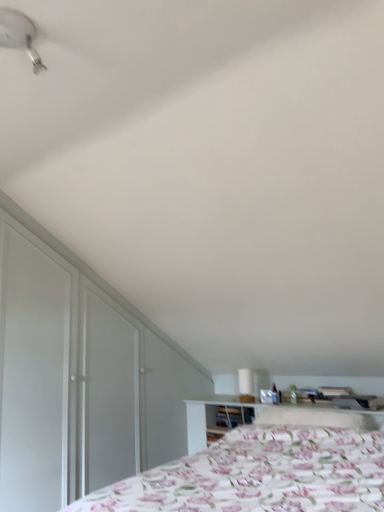
Question: From a real-world perspective, relative to white glossy table lamp at upper center, is white plastic fan at upper left vertically above or below?

Choices:
 (A) above
 (B) below

Answer: (A)

Question: Considering the positions of white plastic fan at upper left and white glossy table lamp at upper center in the image, is white plastic fan at upper left taller or shorter than white glossy table lamp at upper center?

Choices:
 (A) short
 (B) tall

Answer: (A)

Question: Based on their relative distances, which object is nearer to the white plastic fan at upper left?

Choices:
 (A) white glossy dresser at left
 (B) floral fabric bed at lower right
 (C) white glossy table lamp at upper center
 (D) fluffy white pillow at center

Answer: (B)

Question: Which object is the closest to the white plastic fan at upper left?

Choices:
 (A) fluffy white pillow at center
 (B) white glossy dresser at left
 (C) floral fabric bed at lower right
 (D) white glossy table lamp at upper center

Answer: (C)